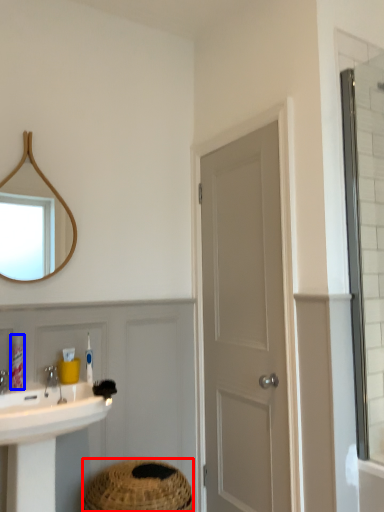
Question: Among these objects, which one is nearest to the camera, basket (highlighted by a red box) or toiletry (highlighted by a blue box)?

Choices:
 (A) basket
 (B) toiletry

Answer: (A)